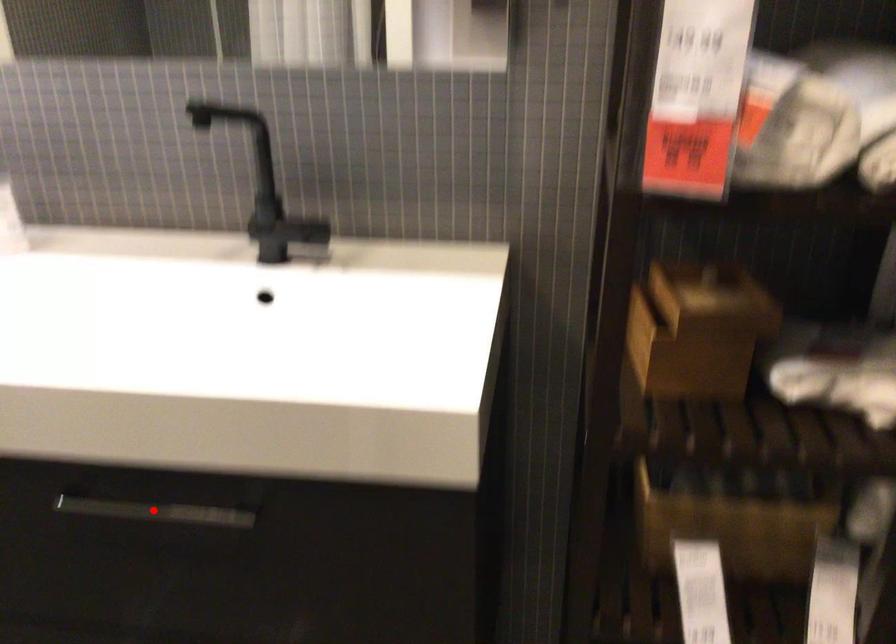
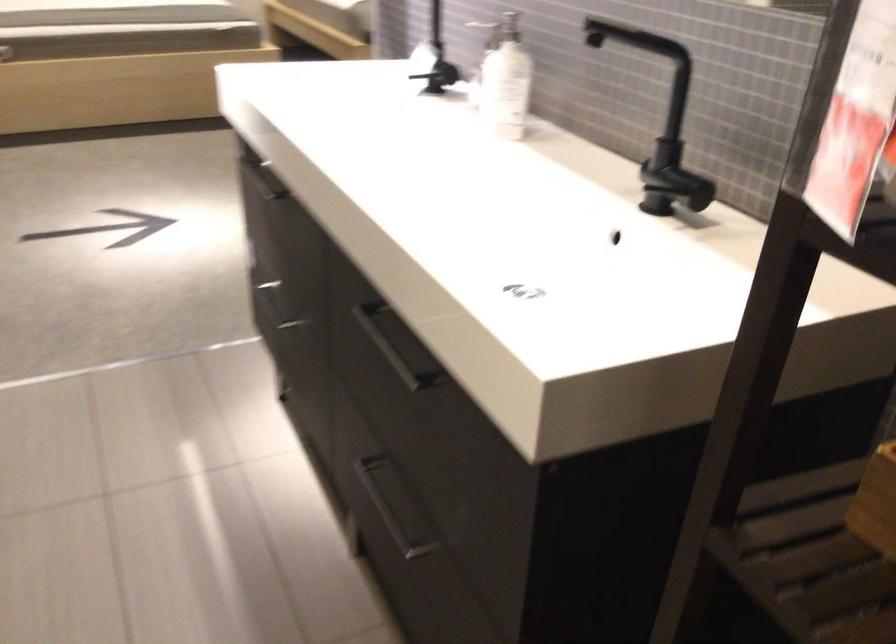
The point at the highlighted location is marked in the first image. Where is the corresponding point in the second image?

(398, 345)